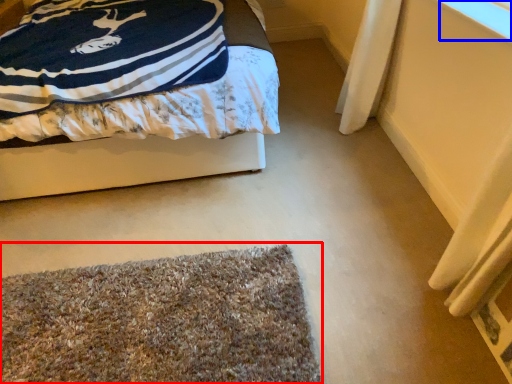
Question: Which object appears farthest to the camera in this image, mat (highlighted by a red box) or window screen (highlighted by a blue box)?

Choices:
 (A) mat
 (B) window screen

Answer: (B)